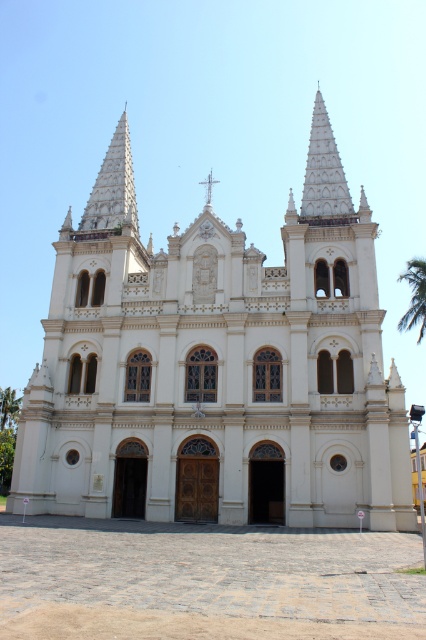
Question: Can you confirm if white stone church at center is positioned above white stone cross at center?

Choices:
 (A) yes
 (B) no

Answer: (B)

Question: In this image, where is white stucco spire at upper center located relative to green leafy palm tree at lower left?

Choices:
 (A) left
 (B) right

Answer: (B)

Question: Among these points, which one is nearest to the camera?

Choices:
 (A) (417, 276)
 (B) (14, 413)

Answer: (A)

Question: Can you confirm if white stone spire at upper left is positioned below white stone cross at center?

Choices:
 (A) no
 (B) yes

Answer: (A)

Question: Which of the following is the farthest from the observer?

Choices:
 (A) (400, 442)
 (B) (333, 209)
 (C) (94, 209)

Answer: (C)

Question: Which point is farther from the camera taking this photo?

Choices:
 (A) (411, 273)
 (B) (19, 403)

Answer: (B)